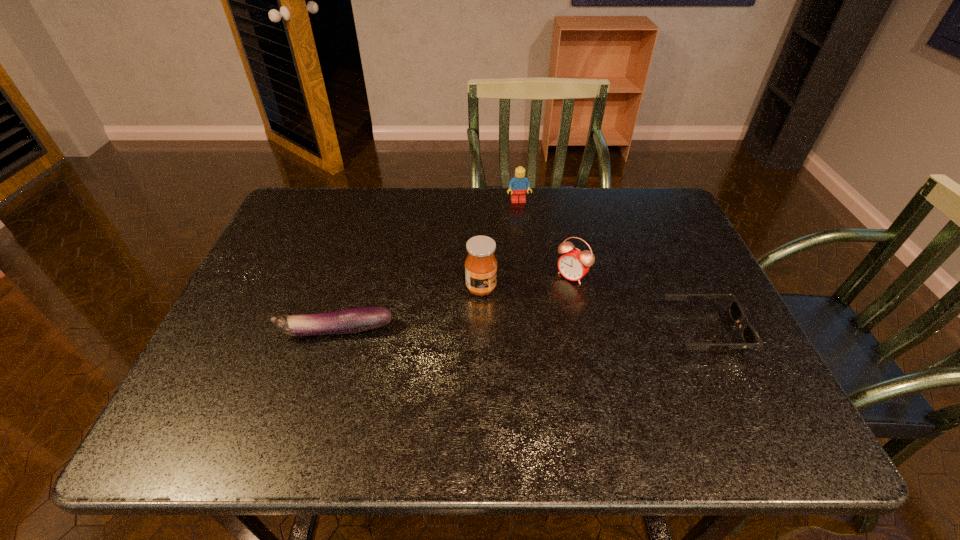
Find the location of a particular element. the fourth tallest object is located at coordinates (359, 319).

I want to click on eggplant, so [x=359, y=319].

Locate an element on the screen. This screenshot has height=540, width=960. the rightmost object is located at coordinates (750, 337).

This screenshot has width=960, height=540. In order to click on sunglasses in this screenshot , I will do `click(750, 337)`.

Identify the location of the tallest object. The height and width of the screenshot is (540, 960). (480, 264).

In order to click on the fourth object from right to left in this screenshot , I will do `click(480, 264)`.

Where is `the fourth object from left to right`? the fourth object from left to right is located at coordinates (574, 264).

What are the coordinates of `the third object from right to left` in the screenshot? It's located at (519, 183).

The height and width of the screenshot is (540, 960). What are the coordinates of `Lego` in the screenshot? It's located at click(519, 183).

You are a GUI agent. You are given a task and a screenshot of the screen. Output one action in this format:
    pyautogui.click(x=<x>, y=<y>)
    Task: Click on the blank space located on the right of the leftmost object
    
    Given the screenshot: What is the action you would take?
    pyautogui.click(x=458, y=331)